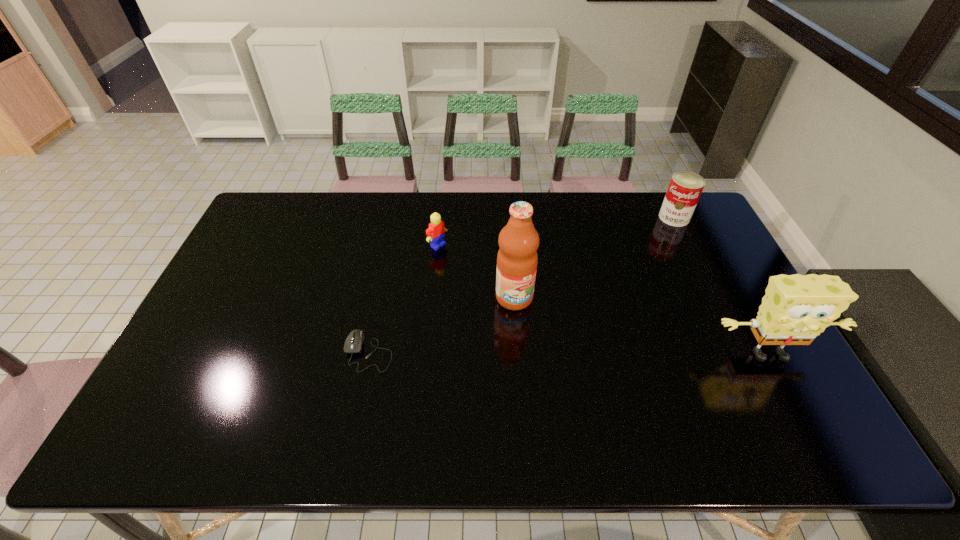
Locate an element on the screen. This screenshot has width=960, height=540. free spot between the shortest object and the fourth nearest object is located at coordinates (403, 298).

The image size is (960, 540). I want to click on vacant region between the fourth shortest object and the third tallest object, so click(721, 286).

At what (x,y) coordinates should I click in order to perform the action: click on free space between the third nearest object and the sponge. Please return your answer as a coordinate pair (x, y). The height and width of the screenshot is (540, 960). Looking at the image, I should click on (641, 326).

Where is `vacant space that is in between the second shortest object and the third object from right to left`? This screenshot has width=960, height=540. vacant space that is in between the second shortest object and the third object from right to left is located at coordinates (476, 271).

The height and width of the screenshot is (540, 960). Identify the location of free space between the third nearest object and the fourth object from right to left. (476, 271).

Find the location of a particular element. This screenshot has height=540, width=960. unoccupied position between the second shortest object and the third shortest object is located at coordinates (556, 231).

Where is `free space between the can and the fourth shortest object`? This screenshot has width=960, height=540. free space between the can and the fourth shortest object is located at coordinates (721, 286).

This screenshot has height=540, width=960. I want to click on vacant area that lies between the fruit juice and the can, so click(x=594, y=258).

The width and height of the screenshot is (960, 540). What are the coordinates of `object that is the third closest to the sponge` in the screenshot? It's located at (435, 233).

Where is `object that ranks as the third closest to the second shortest object`? The width and height of the screenshot is (960, 540). object that ranks as the third closest to the second shortest object is located at coordinates (685, 188).